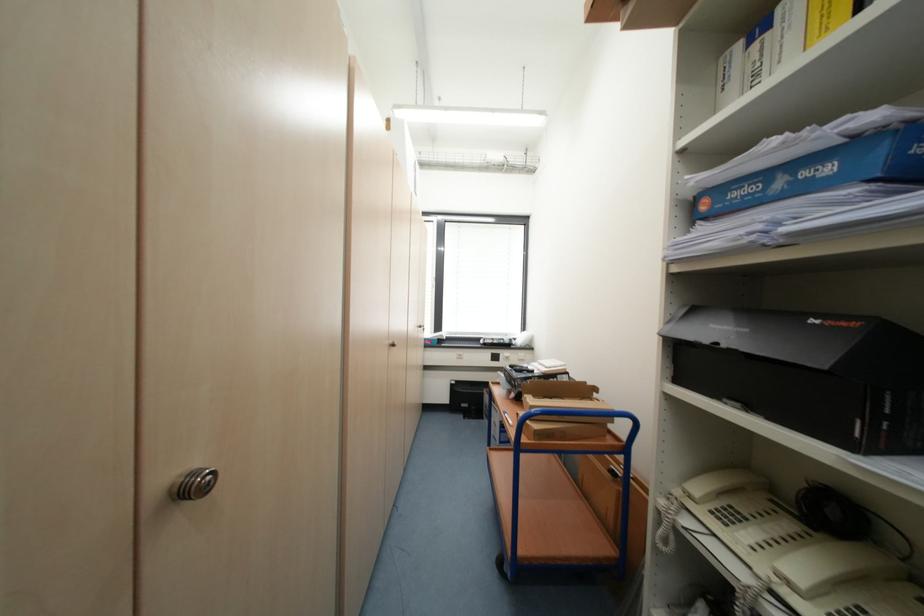
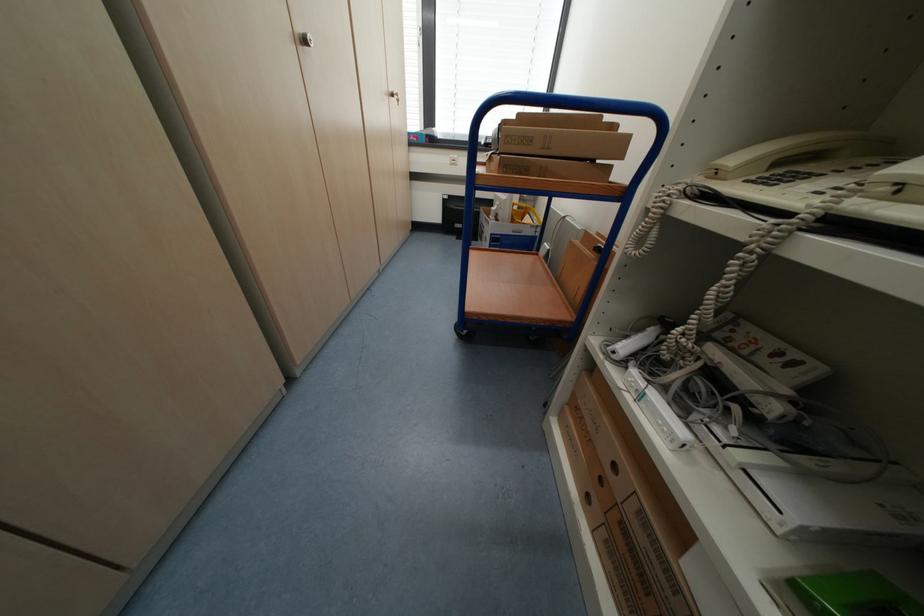
Question: I am providing you with two images of the same scene from different viewpoints. Which of the following objects are not visible in image2?

Choices:
 (A) binder finger hole
 (B) white power strip
 (C) cardboard box
 (D) none of these

Answer: (D)